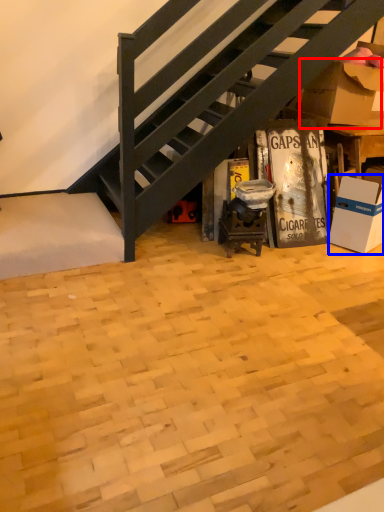
Question: Which object is closer to the camera taking this photo, cardboard box (highlighted by a red box) or box (highlighted by a blue box)?

Choices:
 (A) cardboard box
 (B) box

Answer: (B)